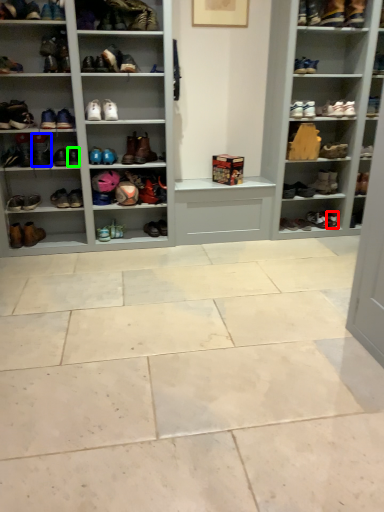
Question: Considering the real-world distances, which object is farthest from shoe (highlighted by a red box)? shoe (highlighted by a blue box) or shoe (highlighted by a green box)?

Choices:
 (A) shoe
 (B) shoe

Answer: (A)